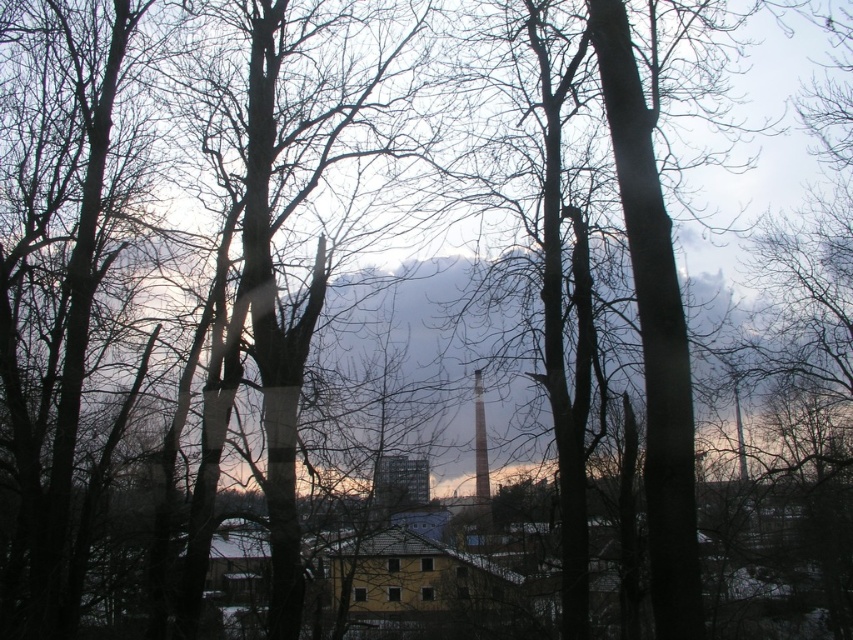
You are a photographer planning to take a picture of the smooth white tower at center and the smooth gray chimney at center through the trees. Based on their sizes, which one would appear more prominent in the photo?

The smooth white tower at center appears more prominent in the photo because it is larger in size than the smooth gray chimney at center.

You are standing in a forest and see a point marked at coordinates (480, 451). What is located at that point?

The point at (480, 451) marks the location of a smooth white tower at center.

You are a drone operator trying to capture aerial footage of the smooth white tower at center and the smooth gray chimney at center. Your camera has a maximum zoom range that can focus on objects within 2.5 centimeters of each other. Can you capture both structures in a single frame without switching zoom levels?

The smooth white tower at center and smooth gray chimney at center are 2.63 centimeters apart, which exceeds the camera maximum zoom range of 2.5 centimeters. Therefore, you cannot capture both in a single frame without adjusting the zoom.